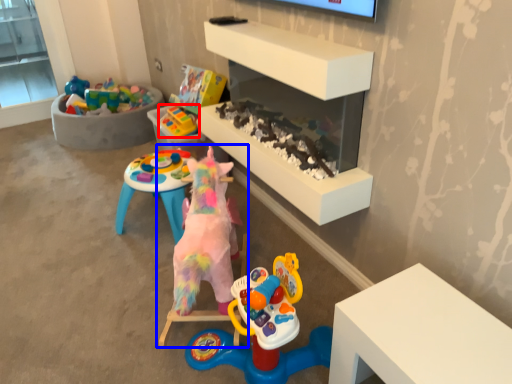
Question: Which of the following is the closest to the observer, toy (highlighted by a red box) or toy (highlighted by a blue box)?

Choices:
 (A) toy
 (B) toy

Answer: (B)